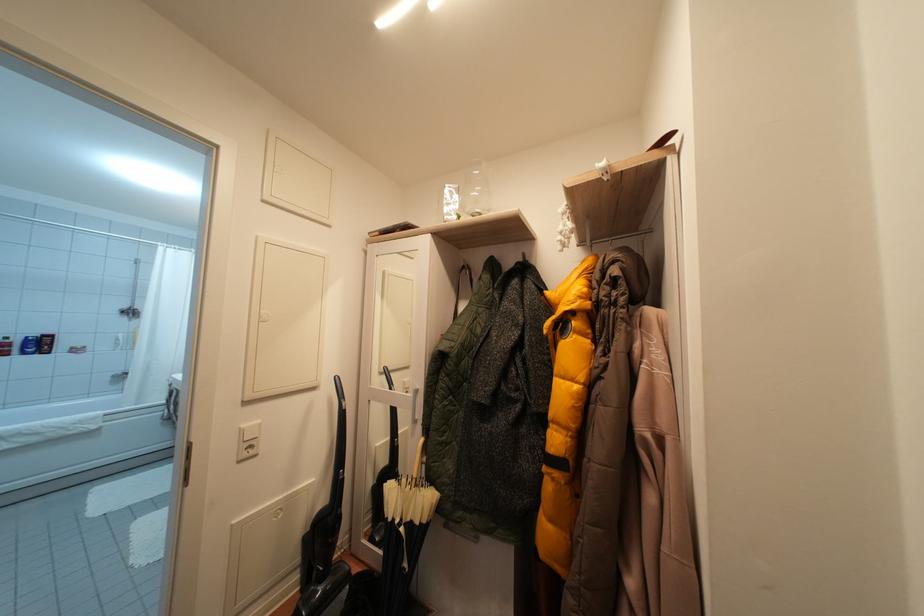
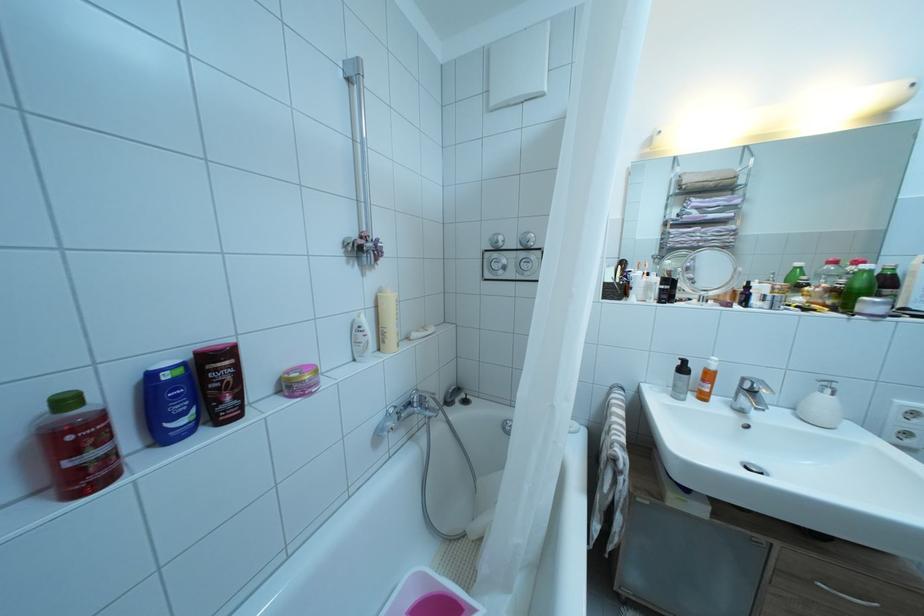
In the scene shown: In a continuous first-person perspective shot, in which direction is the camera moving?

The cameraman walked toward left, forward.